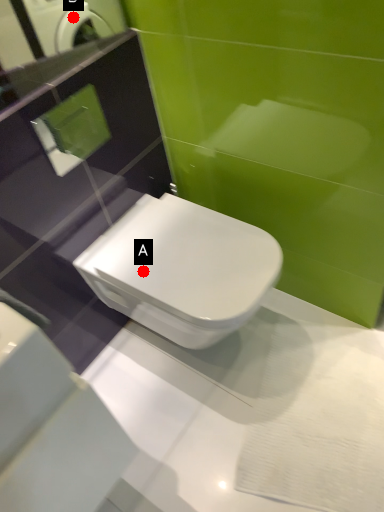
Question: Two points are circled on the image, labeled by A and B beside each circle. Which point is farther from the camera taking this photo?

Choices:
 (A) A is further
 (B) B is further

Answer: (B)